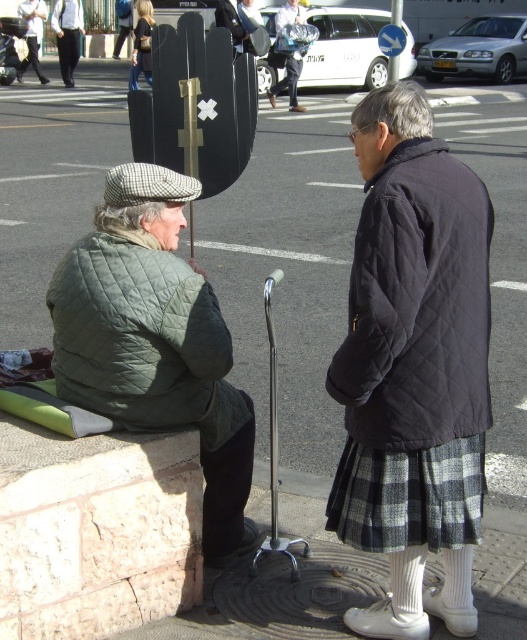
Is black quilted jacket at center to the left of light brown leather jacket at upper left from the viewer's perspective?

Incorrect, black quilted jacket at center is not on the left side of light brown leather jacket at upper left.

Measure the distance between black quilted jacket at center and light brown leather jacket at upper left.

22.28 meters

Who is more distant from viewer, (404, 588) or (38, 13)?

The point (38, 13) is more distant.

Where is `black quilted jacket at center`? This screenshot has height=640, width=527. black quilted jacket at center is located at coordinates (414, 365).

Which is more to the right, quilted green jacket at left or denim jacket at upper left?

quilted green jacket at left is more to the right.

Is quilted green jacket at left positioned before denim jacket at upper left?

Yes, quilted green jacket at left is in front of denim jacket at upper left.

Is point (58, 392) farther from camera compared to point (149, 8)?

No, (58, 392) is in front of (149, 8).

Where is `quilted green jacket at left`? quilted green jacket at left is located at coordinates (154, 340).

Between quilted green jacket at left and light brown leather jacket at upper left, which one has more height?

light brown leather jacket at upper left is taller.

Who is positioned more to the right, quilted green jacket at left or light brown leather jacket at upper left?

quilted green jacket at left is more to the right.

Is point (187, 324) less distant than point (36, 1)?

Yes, it is in front of point (36, 1).

I want to click on quilted green jacket at left, so click(x=154, y=340).